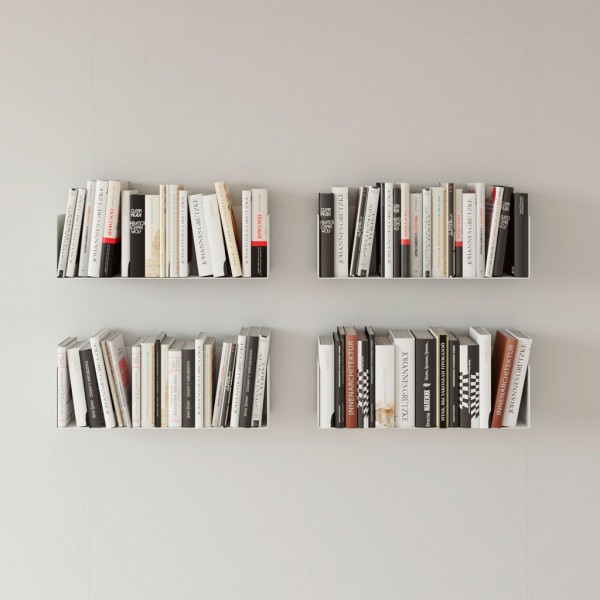
This screenshot has height=600, width=600. What are the coordinates of `books that have almost completely white book cover on the book spine area` in the screenshot? It's located at (326, 379), (484, 383), (77, 385), (124, 244), (217, 245).